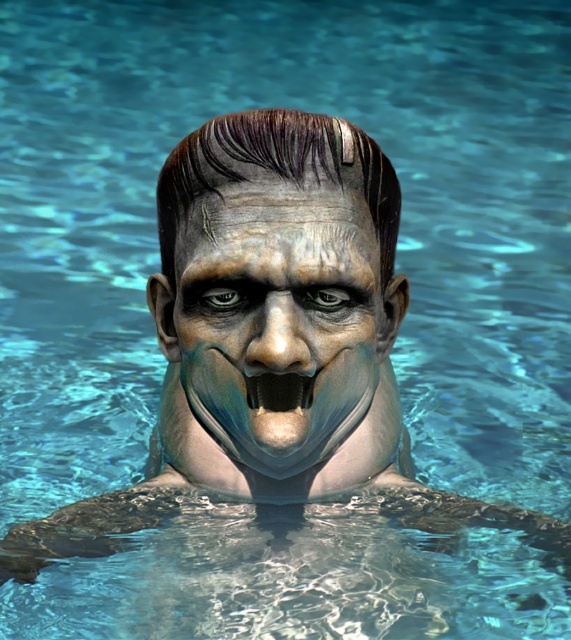
Is pale matte face at center taller than black matte teeth at center?

Indeed, pale matte face at center has a greater height compared to black matte teeth at center.

Who is shorter, pale matte face at center or black matte teeth at center?

Standing shorter between the two is black matte teeth at center.

Which is behind, point (311, 300) or point (259, 401)?

The point (259, 401) is more distant.

The image size is (571, 640). Find the location of `pale matte face at center`. pale matte face at center is located at coordinates (278, 320).